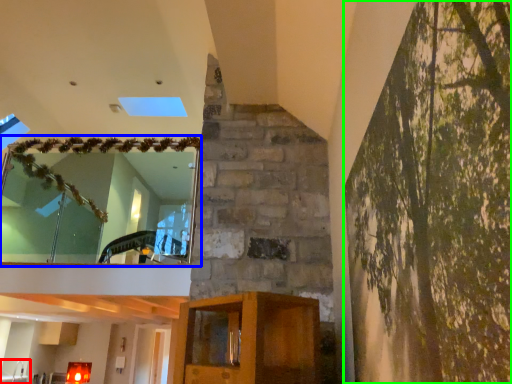
Question: Estimate the real-world distances between objects in this image. Which object is closer to sink (highlighted by a red box), window (highlighted by a blue box) or tree (highlighted by a green box)?

Choices:
 (A) window
 (B) tree

Answer: (A)